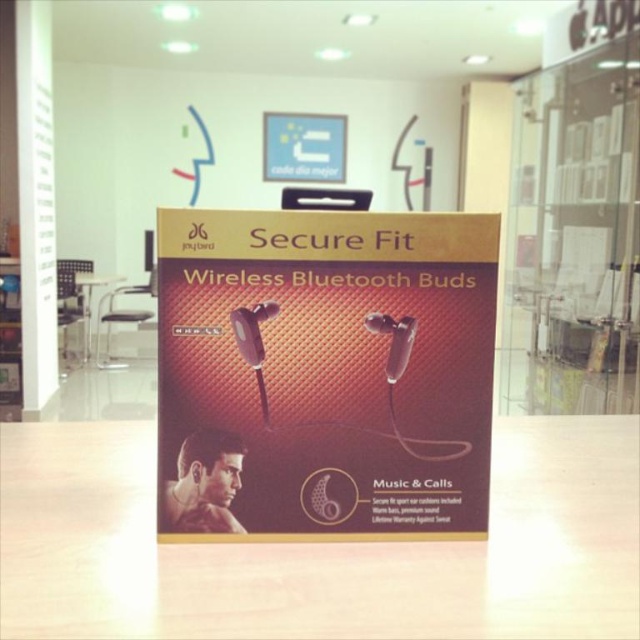
Can you confirm if wooden table at center is thinner than matte black speaker at center?

No.

In the scene shown: Who is more forward, (518, 540) or (147, 241)?

Point (518, 540)

Find the location of a particular element. This screenshot has height=640, width=640. wooden table at center is located at coordinates (320, 548).

At what (x,y) coordinates should I click in order to perform the action: click on white glossy table at center. Please return your answer as a coordinate pair (x, y). Looking at the image, I should click on (90, 300).

Can you confirm if clear plastic microphone at center is shorter than white glossy table at center?

Yes, clear plastic microphone at center is shorter than white glossy table at center.

At what (x,y) coordinates should I click in order to perform the action: click on clear plastic microphone at center. Please return your answer as a coordinate pair (x, y). Looking at the image, I should click on (x=394, y=340).

Who is more distant from viewer, (x=401, y=317) or (x=88, y=292)?

The point (x=88, y=292) is behind.

This screenshot has height=640, width=640. I want to click on clear plastic microphone at center, so click(394, 340).